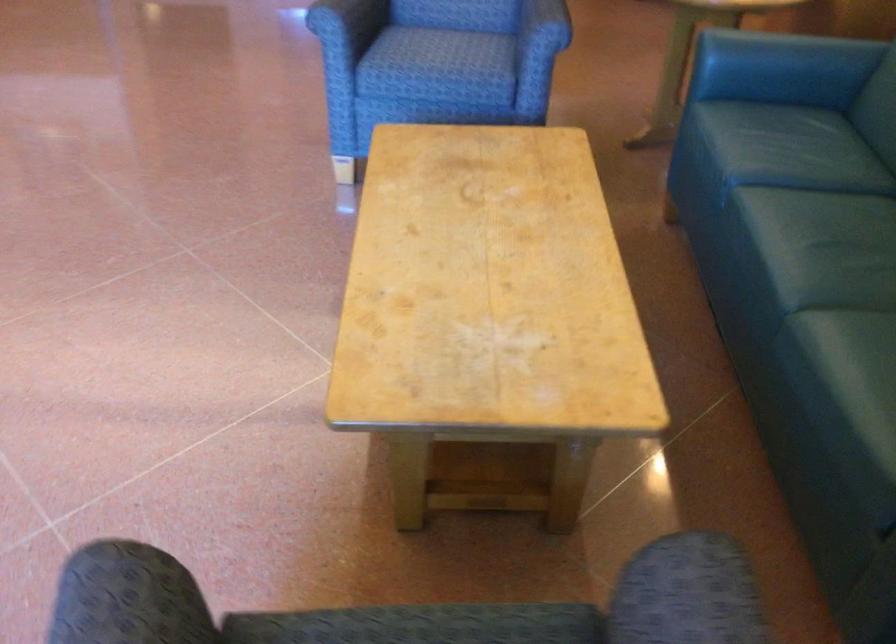
Locate an element on the screen. Image resolution: width=896 pixels, height=644 pixels. green sofa armrest is located at coordinates (785, 53).